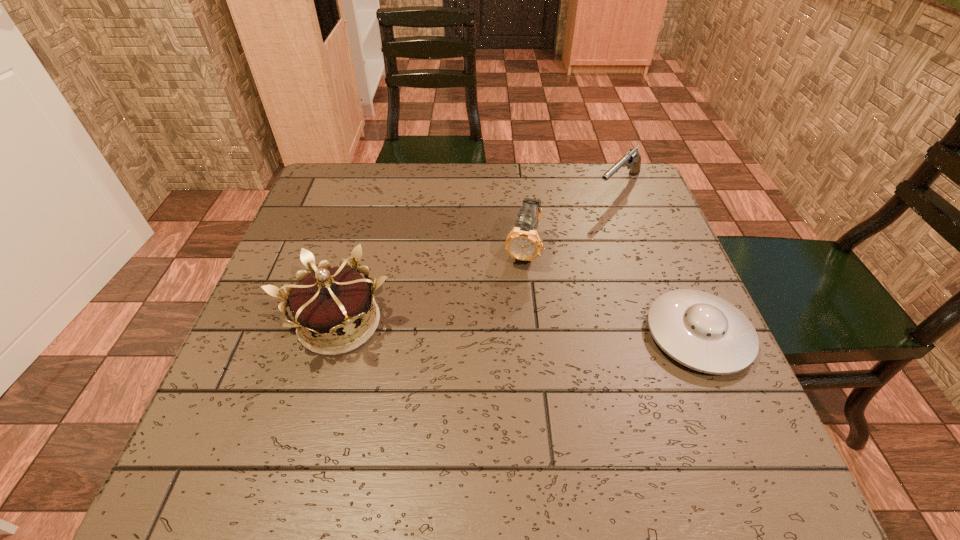
Identify the location of crown. (330, 303).

Find the location of `saucer`. saucer is located at coordinates (701, 331).

Where is `the second object from left to right`? the second object from left to right is located at coordinates (523, 243).

The height and width of the screenshot is (540, 960). I want to click on watch, so click(523, 243).

Where is `the second shortest object`? the second shortest object is located at coordinates (632, 158).

The height and width of the screenshot is (540, 960). Identify the location of the farthest object. (632, 158).

The width and height of the screenshot is (960, 540). I want to click on vacant space located on the back of the crown, so click(x=354, y=268).

The height and width of the screenshot is (540, 960). In order to click on vacant space located 0.400m on the left of the saucer in this screenshot , I will do `click(441, 335)`.

I want to click on vacant space located 0.250m on the face of the third object from right to left, so click(x=496, y=367).

Where is `vacant space located on the face of the third object from right to left`? Image resolution: width=960 pixels, height=540 pixels. vacant space located on the face of the third object from right to left is located at coordinates (510, 313).